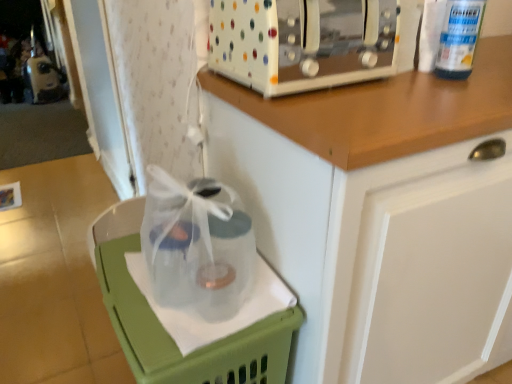
Find the location of a particular element. Image resolution: width=512 pixels, height=384 pixels. free space in front of white polka dot toaster at upper center is located at coordinates (347, 109).